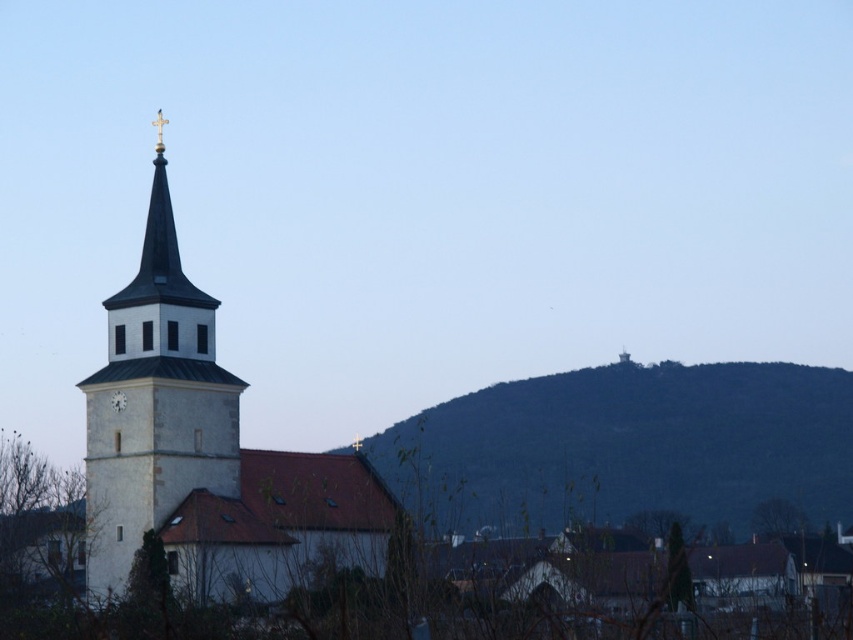
You are standing at the base of the green textured hill at center. Looking towards the church, which direction should you face to see the steeple clearly?

Since the green textured hill at center is located at point (627, 445), you should face north to see the steeple clearly as it is positioned opposite the hill in the scene.

You are an architect designing a new garden layout. You have to place a statue exactly halfway between the green textured hill at center and the white stone bell tower at left. Given that the hill is larger than the bell tower, which object will the statue be closer to?

The statue will be closer to the white stone bell tower at left because the green textured hill at center is bigger, so the halfway point would be nearer to the smaller object.

You are standing in the middle of the field looking at the church scene. The white stone bell tower at left and the green textured hill at center are both in your view. Which object is farther away from you?

The white stone bell tower at left is farther away from you because it is positioned behind the green textured hill at center.